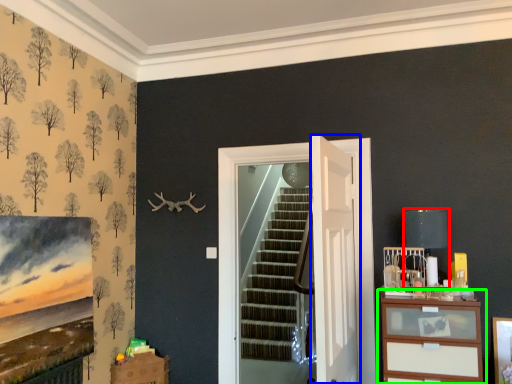
Question: Based on their relative distances, which object is nearer to lamp (highlighted by a red box)? Choose from door (highlighted by a blue box) and chest of drawers (highlighted by a green box).

Choices:
 (A) door
 (B) chest of drawers

Answer: (B)